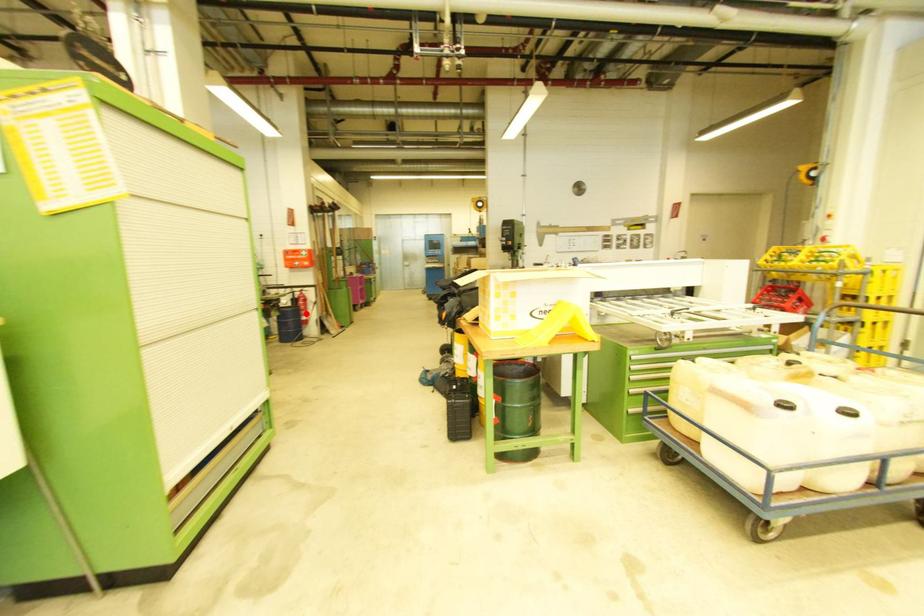
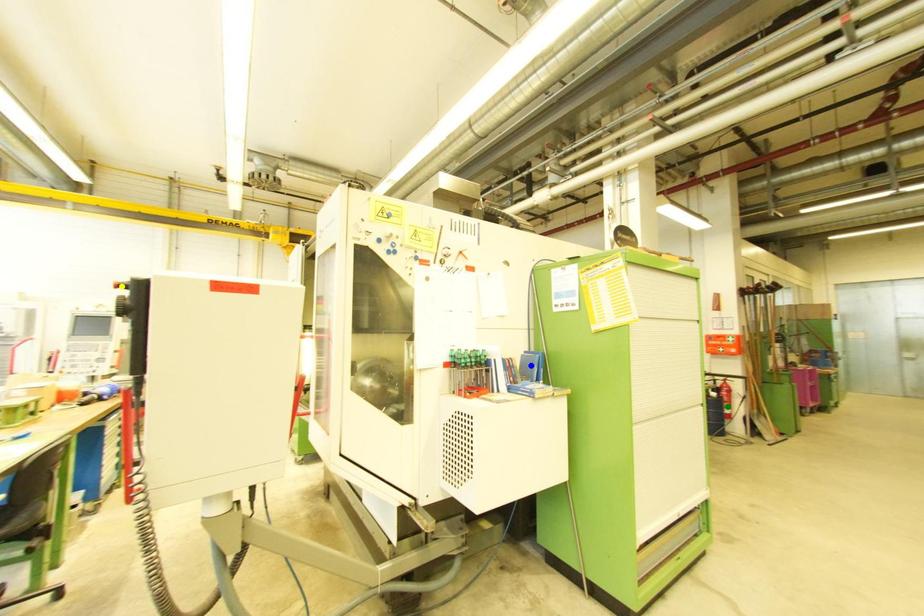
Question: I am providing you with two images of the same scene from different viewpoints. A red point is marked on the first image. You are given multiple points on the second image. Which spot in image 2 lines up with the point in image 1?

Choices:
 (A) blue point
 (B) yellow point
 (C) green point

Answer: (C)